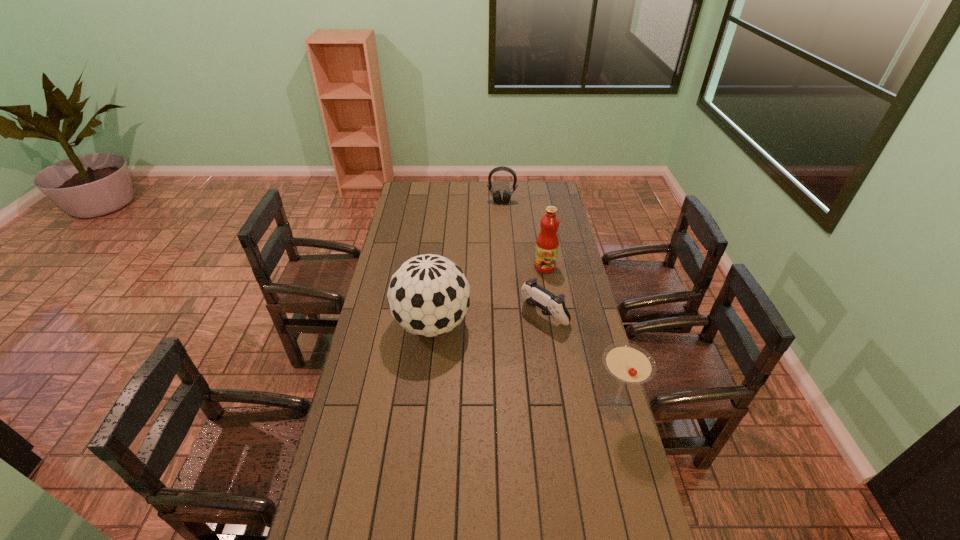
You are a GUI agent. You are given a task and a screenshot of the screen. Output one action in this format:
    pyautogui.click(x=<x>, y=<y>)
    Task: Click on the blank area located 0.380m on the front-facing side of the farthest object
    The image size is (960, 540).
    Given the screenshot: What is the action you would take?
    pyautogui.click(x=498, y=247)

Locate an element on the screen. The width and height of the screenshot is (960, 540). vacant region located on the front-facing side of the farthest object is located at coordinates (500, 217).

The height and width of the screenshot is (540, 960). In order to click on vacant position located on the front label of the fruit juice in this screenshot , I will do (x=532, y=311).

Find the location of `vacant space located 0.060m on the front label of the fruit juice`. vacant space located 0.060m on the front label of the fruit juice is located at coordinates (540, 282).

The height and width of the screenshot is (540, 960). Identify the location of vacant space located 0.170m on the front label of the fruit juice. (536, 299).

This screenshot has width=960, height=540. I want to click on vacant region located 0.350m on the front-facing side of the control, so click(468, 379).

The height and width of the screenshot is (540, 960). I want to click on blank space located 0.080m on the front-facing side of the control, so click(x=516, y=338).

I want to click on free location located 0.210m on the front-facing side of the control, so click(493, 356).

Image resolution: width=960 pixels, height=540 pixels. I want to click on object that is at the far edge, so click(496, 195).

In order to click on object located at the left edge in this screenshot , I will do `click(428, 295)`.